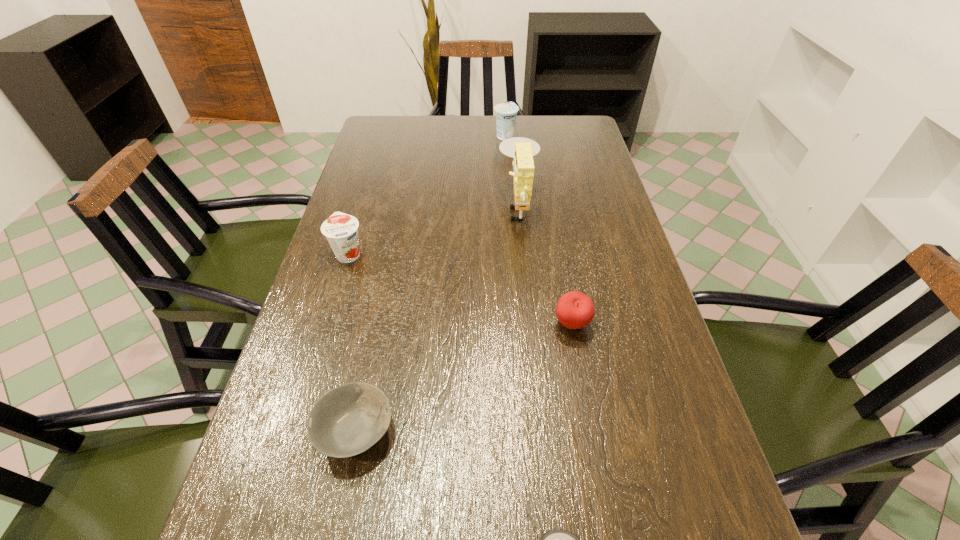
Image resolution: width=960 pixels, height=540 pixels. In the image, there is a desktop. Find the location of `vacant space at the left edge`. vacant space at the left edge is located at coordinates (376, 193).

You are a GUI agent. You are given a task and a screenshot of the screen. Output one action in this format:
    pyautogui.click(x=<x>, y=<y>)
    Task: Click on the vacant region at the right edge of the desktop
    The height and width of the screenshot is (540, 960).
    Given the screenshot: What is the action you would take?
    pyautogui.click(x=617, y=294)

I want to click on free area in between the apple and the third farthest object, so click(460, 289).

Find the location of a particular element. free space between the farthest object and the apple is located at coordinates (539, 230).

Identify the location of unoccupied area between the apple and the fifth farthest object. (464, 377).

Where is `free spot between the fourth nearest object and the sponge`? free spot between the fourth nearest object and the sponge is located at coordinates (434, 229).

Identify the location of empty location between the sponge and the farthest yogurt. (512, 171).

Find the location of a particular element. free space between the fourth farthest object and the sponge is located at coordinates (545, 265).

This screenshot has width=960, height=540. Find the location of `object that is the closest to the second nearest object`. object that is the closest to the second nearest object is located at coordinates (556, 539).

Choose which object is the fifth nearest neighbor to the apple. Please provide its 2D coordinates. Your answer should be formatted as a tuple, i.e. [(x, y)], where the tuple contains the x and y coordinates of a point satisfying the conditions above.

[(506, 113)]